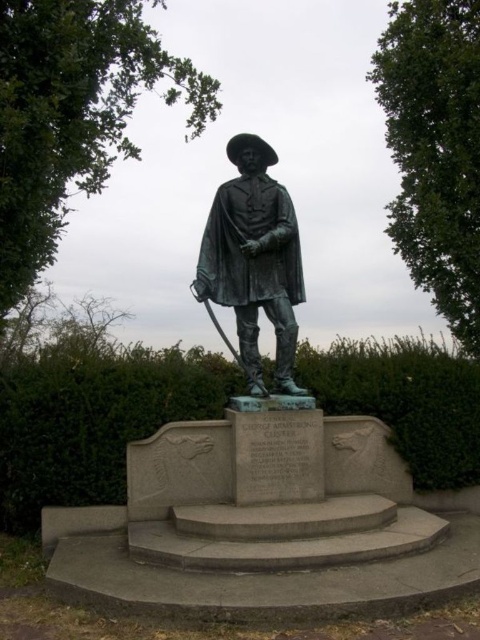
You are a gardener who needs to trim the green hedge at center and the bronze statue at center. Which object requires more effort due to its size?

The green hedge at center requires more effort to trim because it is larger in size than the bronze statue at center.

You are a landscape architect designing a garden path that needs to pass between the green hedge at center and the bronze statue at center. Based on the scene description, which object has a wider structure to consider for the path width?

The green hedge at center has a larger width than the bronze statue at center, so the path should be designed to accommodate the green hedge at center first.